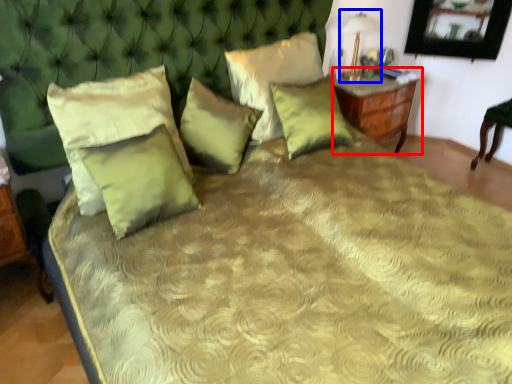
Question: Which object is further to the camera taking this photo, nightstand (highlighted by a red box) or table lamp (highlighted by a blue box)?

Choices:
 (A) nightstand
 (B) table lamp

Answer: (A)